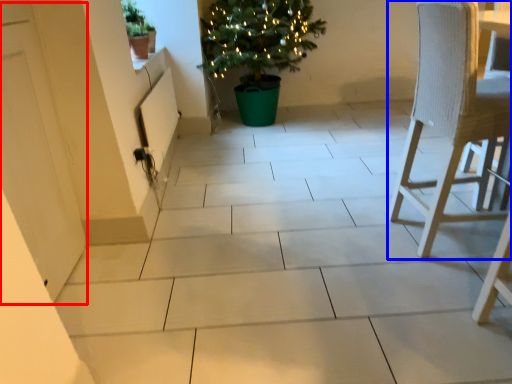
Question: Which object is closer to the camera taking this photo, screen door (highlighted by a red box) or chair (highlighted by a blue box)?

Choices:
 (A) screen door
 (B) chair

Answer: (A)